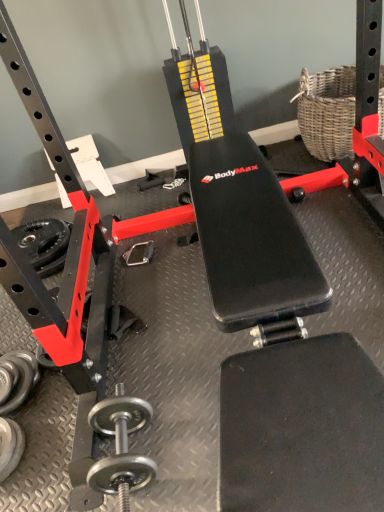
Question: Is silver metallic dumbbell at lower left, marked as the first dumbbell in a left-to-right arrangement, located outside rubberized black weight at lower left?

Choices:
 (A) yes
 (B) no

Answer: (A)

Question: Does silver metallic dumbbell at lower left, which is the third dumbbell in right-to-left order, turn towards rubberized black weight at lower left?

Choices:
 (A) no
 (B) yes

Answer: (A)

Question: Is silver metallic dumbbell at lower left, which is the third dumbbell in right-to-left order, behind rubberized black weight at lower left?

Choices:
 (A) yes
 (B) no

Answer: (B)

Question: From the image's perspective, does silver metallic dumbbell at lower left, marked as the first dumbbell in a left-to-right arrangement, appear higher than rubberized black weight at lower left?

Choices:
 (A) yes
 (B) no

Answer: (B)

Question: Is silver metallic dumbbell at lower left, marked as the first dumbbell in a left-to-right arrangement, situated inside polished silver dumbbell at lower left, marked as the first dumbbell in a right-to-left arrangement, or outside?

Choices:
 (A) inside
 (B) outside

Answer: (B)

Question: Considering the positions of point (34, 376) and point (132, 476), is point (34, 376) closer or farther from the camera than point (132, 476)?

Choices:
 (A) farther
 (B) closer

Answer: (A)

Question: Based on their sizes in the image, would you say silver metallic dumbbell at lower left, which is the third dumbbell in right-to-left order, is bigger or smaller than polished silver dumbbell at lower left, marked as the first dumbbell in a right-to-left arrangement?

Choices:
 (A) small
 (B) big

Answer: (A)

Question: Visually, is silver metallic dumbbell at lower left, marked as the first dumbbell in a left-to-right arrangement, positioned to the left or to the right of polished silver dumbbell at lower left, marked as the first dumbbell in a right-to-left arrangement?

Choices:
 (A) right
 (B) left

Answer: (B)

Question: Which is correct: polished silver dumbbell at lower left, which ranks as the third dumbbell in left-to-right order, is inside woven wicker basket at upper right, or outside of it?

Choices:
 (A) inside
 (B) outside

Answer: (B)

Question: Relative to woven wicker basket at upper right, is polished silver dumbbell at lower left, which ranks as the third dumbbell in left-to-right order, in front or behind?

Choices:
 (A) front
 (B) behind

Answer: (A)

Question: Is polished silver dumbbell at lower left, which ranks as the third dumbbell in left-to-right order, wider or thinner than woven wicker basket at upper right?

Choices:
 (A) thin
 (B) wide

Answer: (A)

Question: In terms of height, does polished silver dumbbell at lower left, marked as the first dumbbell in a right-to-left arrangement, look taller or shorter compared to woven wicker basket at upper right?

Choices:
 (A) tall
 (B) short

Answer: (B)

Question: Relative to woven wicker basket at upper right, is silver metallic dumbbell at lower left, which is the third dumbbell in right-to-left order, in front or behind?

Choices:
 (A) front
 (B) behind

Answer: (A)

Question: Based on their positions, is silver metallic dumbbell at lower left, which is the third dumbbell in right-to-left order, located to the left or right of woven wicker basket at upper right?

Choices:
 (A) left
 (B) right

Answer: (A)